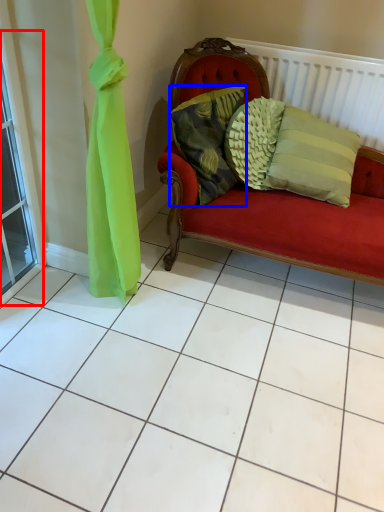
Question: Which object appears closest to the camera in this image, window (highlighted by a red box) or pillow (highlighted by a blue box)?

Choices:
 (A) window
 (B) pillow

Answer: (A)